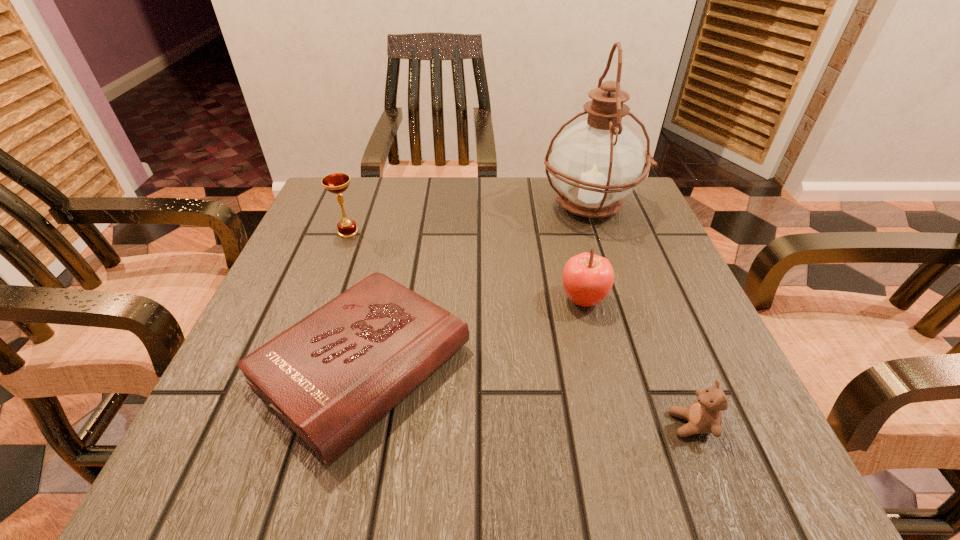
The height and width of the screenshot is (540, 960). Identify the location of blank area located 0.350m on the front-facing side of the teddy bear. (426, 424).

This screenshot has height=540, width=960. I want to click on vacant space located on the back of the shortest object, so click(396, 230).

In order to click on oil lamp at the far edge in this screenshot , I will do `click(596, 163)`.

Find the location of a particular element. chalice at the far edge is located at coordinates (336, 183).

I want to click on teddy bear that is at the near edge, so click(x=704, y=416).

Identify the location of hardback book present at the near edge. (331, 376).

You are a GUI agent. You are given a task and a screenshot of the screen. Output one action in this format:
    pyautogui.click(x=<x>, y=<y>)
    Task: Click on the chalice located in the left edge section of the desktop
    Image resolution: width=960 pixels, height=540 pixels.
    Given the screenshot: What is the action you would take?
    pyautogui.click(x=336, y=183)

This screenshot has height=540, width=960. Find the location of `hardback book that is at the left edge`. hardback book that is at the left edge is located at coordinates (331, 376).

This screenshot has width=960, height=540. In order to click on oil lamp at the right edge in this screenshot , I will do `click(596, 163)`.

The height and width of the screenshot is (540, 960). What are the coordinates of `apple located in the right edge section of the desktop` in the screenshot? It's located at (587, 278).